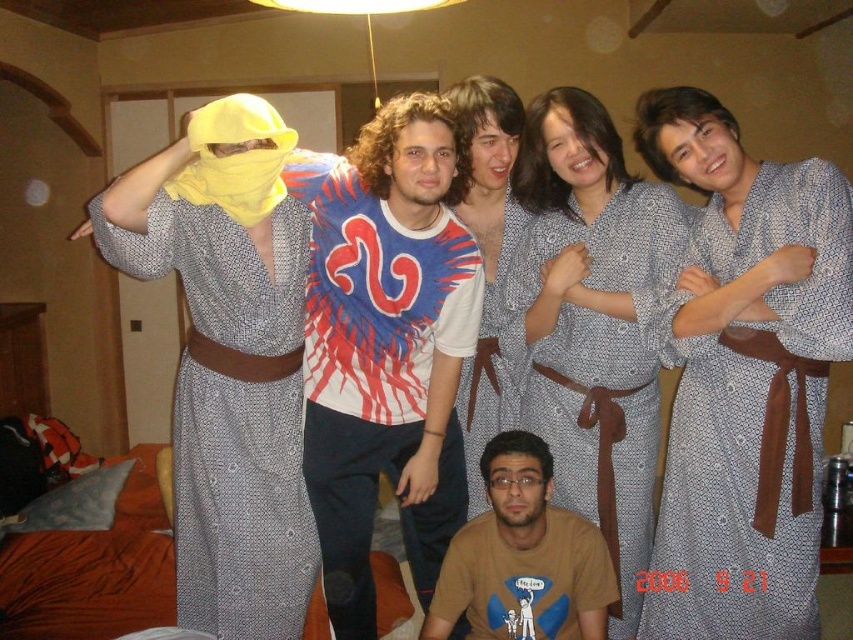
Question: Is textured gray robe at left wider than textured gray robe at center?

Choices:
 (A) no
 (B) yes

Answer: (A)

Question: Is textured gray robe at center bigger than brown cotton t-shirt at lower center?

Choices:
 (A) no
 (B) yes

Answer: (B)

Question: Which of these objects is positioned closest to the brown cotton t-shirt at lower center?

Choices:
 (A) textured gray robe at left
 (B) textured blue shirt at center

Answer: (B)

Question: Where is brown cotton t-shirt at lower center located in relation to textured blue shirt at center in the image?

Choices:
 (A) above
 (B) below

Answer: (B)

Question: Among these objects, which one is nearest to the camera?

Choices:
 (A) gray textured robe at center
 (B) textured blue shirt at center
 (C) textured gray robe at center

Answer: (A)

Question: Which of the following is the farthest from the observer?

Choices:
 (A) (590, 356)
 (B) (712, 486)

Answer: (A)